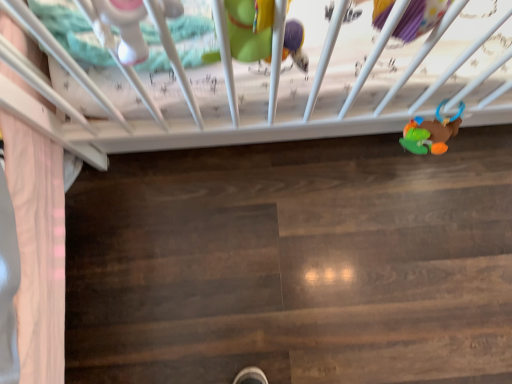
Question: Is matte green plush toy at upper center, which ranks as the second toy in back-to-front order, directly adjacent to rubberized plastic rattle at lower right, the third toy in the front-to-back sequence?

Choices:
 (A) yes
 (B) no

Answer: (B)

Question: Does matte green plush toy at upper center, arranged as the 2th toy when viewed from the left, appear on the right side of rubberized plastic rattle at lower right, the 1th toy viewed from the right?

Choices:
 (A) no
 (B) yes

Answer: (A)

Question: From the image's perspective, is matte green plush toy at upper center, which ranks as the second toy in right-to-left order, over rubberized plastic rattle at lower right, the first toy from the back?

Choices:
 (A) yes
 (B) no

Answer: (A)

Question: Is matte green plush toy at upper center, which ranks as the second toy in right-to-left order, outside rubberized plastic rattle at lower right, the third toy in the front-to-back sequence?

Choices:
 (A) no
 (B) yes

Answer: (B)

Question: Can you confirm if matte green plush toy at upper center, which is the second toy from front to back, is taller than rubberized plastic rattle at lower right, the first toy from the back?

Choices:
 (A) no
 (B) yes

Answer: (B)

Question: Is matte green plush toy at upper center, which ranks as the second toy in back-to-front order, wider or thinner than rubberized plastic rattle at lower right, marked as the third toy in a left-to-right arrangement?

Choices:
 (A) thin
 (B) wide

Answer: (A)

Question: Is matte green plush toy at upper center, which ranks as the second toy in right-to-left order, in front of or behind rubberized plastic rattle at lower right, marked as the third toy in a left-to-right arrangement, in the image?

Choices:
 (A) front
 (B) behind

Answer: (A)

Question: Is matte green plush toy at upper center, arranged as the 2th toy when viewed from the left, bigger or smaller than rubberized plastic rattle at lower right, the first toy from the back?

Choices:
 (A) big
 (B) small

Answer: (A)

Question: Is matte green plush toy at upper center, which is the second toy from front to back, situated inside rubberized plastic rattle at lower right, the third toy in the front-to-back sequence, or outside?

Choices:
 (A) outside
 (B) inside

Answer: (A)

Question: From the image's perspective, is rubberized plastic rattle at lower right, marked as the third toy in a left-to-right arrangement, above or below matte plastic rattle at upper left, the third toy when ordered from right to left?

Choices:
 (A) below
 (B) above

Answer: (A)

Question: Does point (418, 134) appear closer or farther from the camera than point (163, 8)?

Choices:
 (A) farther
 (B) closer

Answer: (A)

Question: Choose the correct answer: Is rubberized plastic rattle at lower right, the 1th toy viewed from the right, inside matte plastic rattle at upper left, which is the first toy in front-to-back order, or outside it?

Choices:
 (A) inside
 (B) outside

Answer: (B)

Question: Considering the positions of rubberized plastic rattle at lower right, marked as the third toy in a left-to-right arrangement, and matte plastic rattle at upper left, which is the first toy in front-to-back order, in the image, is rubberized plastic rattle at lower right, marked as the third toy in a left-to-right arrangement, bigger or smaller than matte plastic rattle at upper left, which is the first toy in front-to-back order,?

Choices:
 (A) big
 (B) small

Answer: (A)

Question: From the image's perspective, relative to matte plastic rattle at upper left, which is the first toy in front-to-back order, is matte green plush toy at upper center, which ranks as the second toy in right-to-left order, above or below?

Choices:
 (A) above
 (B) below

Answer: (A)

Question: From their relative heights in the image, would you say matte green plush toy at upper center, which is the second toy from front to back, is taller or shorter than matte plastic rattle at upper left, which is the first toy in front-to-back order?

Choices:
 (A) short
 (B) tall

Answer: (B)